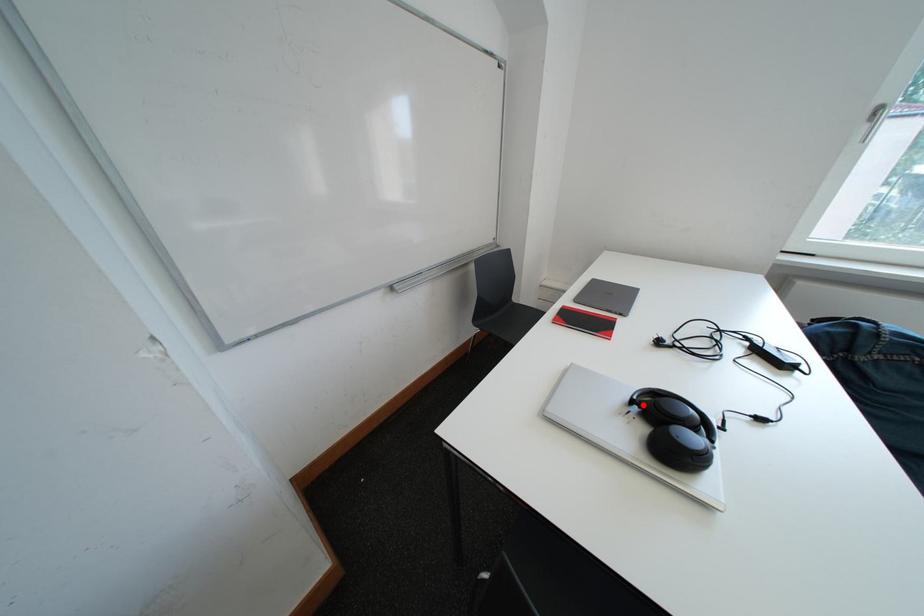
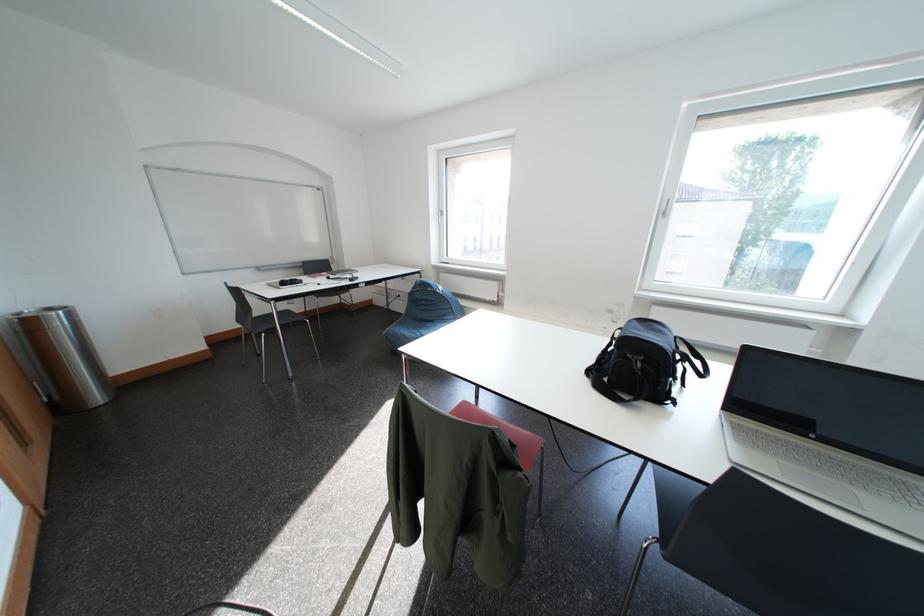
Question: I am providing you with two images of the same scene from different viewpoints. A red point is marked on the first image. At the location where the point appears in image 1, is it still visible in image 2?

Choices:
 (A) Yes
 (B) No

Answer: (B)